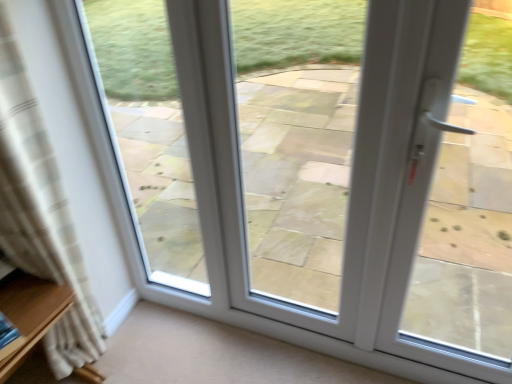
Describe the element at coordinates (31, 313) in the screenshot. I see `wooden shelf at left` at that location.

Find the location of a particular element. wooden shelf at left is located at coordinates (31, 313).

What is the approximate height of white glass door at left?

white glass door at left is 1.23 meters in height.

Identify the location of white glass door at left. Image resolution: width=512 pixels, height=384 pixels. (149, 134).

Describe the element at coordinates (41, 213) in the screenshot. I see `beige plaid curtain at left` at that location.

You are a GUI agent. You are given a task and a screenshot of the screen. Output one action in this format:
    pyautogui.click(x=<x>, y=<y>)
    Task: Click on the beige plaid curtain at left
    The height and width of the screenshot is (384, 512).
    Given the screenshot: What is the action you would take?
    pyautogui.click(x=41, y=213)

Locate an element on the screen. The image size is (512, 384). white glass door at center is located at coordinates (297, 140).

Locate an element on the screen. white plastic door handle at right is located at coordinates (437, 207).

In the scene shown: Looking at their sizes, would you say white plastic door handle at right is wider or thinner than beige plaid curtain at left?

In the image, white plastic door handle at right appears to be more narrow than beige plaid curtain at left.

Is white plastic door handle at right surrounding beige plaid curtain at left?

That's incorrect, beige plaid curtain at left is not inside white plastic door handle at right.

Between white plastic door handle at right and beige plaid curtain at left, which one has smaller size?

white plastic door handle at right is smaller.

Is point (413, 182) behind point (15, 248)?

No, (413, 182) is closer to viewer.

From a real-world perspective, does white glass door at center stand above beige plaid curtain at left?

Indeed, from a real-world perspective, white glass door at center stands above beige plaid curtain at left.

From the image's perspective, between white glass door at center and beige plaid curtain at left, who is located below?

beige plaid curtain at left, from the image's perspective.

Considering the sizes of objects white glass door at center and beige plaid curtain at left in the image provided, who is bigger, white glass door at center or beige plaid curtain at left?

With larger size is beige plaid curtain at left.

Are white glass door at center and white glass door at left far apart?

Actually, white glass door at center and white glass door at left are a little close together.

Could you tell me if white glass door at center is facing white glass door at left?

No, white glass door at center is not aimed at white glass door at left.

Is point (344, 60) behind point (99, 0)?

Yes, point (344, 60) is behind point (99, 0).

From a real-world perspective, is white glass door at center on top of white glass door at left?

Yes, from a real-world perspective, white glass door at center is over white glass door at left

Does wooden shelf at left come behind white glass door at center?

Yes, it is.

Which of these two, wooden shelf at left or white glass door at center, is bigger?

Bigger between the two is wooden shelf at left.

Considering the sizes of wooden shelf at left and white glass door at center in the image, is wooden shelf at left taller or shorter than white glass door at center?

Clearly, wooden shelf at left is shorter compared to white glass door at center.

Relative to wooden shelf at left, is white glass door at center in front or behind?

white glass door at center is in front of wooden shelf at left.

Visually, is white glass door at center positioned to the left or to the right of wooden shelf at left?

Clearly, white glass door at center is on the right of wooden shelf at left in the image.

From a real-world perspective, is white glass door at center positioned above or below wooden shelf at left?

In terms of real-world spatial position, white glass door at center is above wooden shelf at left.

How distant is white glass door at left from white plastic door handle at right?

white glass door at left is 4.76 feet away from white plastic door handle at right.

Between white glass door at left and white plastic door handle at right, which one appears on the right side from the viewer's perspective?

white plastic door handle at right.

Who is taller, white glass door at left or white plastic door handle at right?

Standing taller between the two is white plastic door handle at right.

Is wooden shelf at left spatially inside white glass door at left, or outside of it?

wooden shelf at left is outside white glass door at left.

Which object is positioned more to the left, wooden shelf at left or white glass door at left?

From the viewer's perspective, wooden shelf at left appears more on the left side.

Are wooden shelf at left and white glass door at left far apart?

No, wooden shelf at left is not far away from white glass door at left.

Where is `screen door located below the beige plaid curtain at left (from the image's perspective)`? screen door located below the beige plaid curtain at left (from the image's perspective) is located at coordinates (437, 207).

Locate an element on the screen. This screenshot has height=384, width=512. window on the right of beige plaid curtain at left is located at coordinates 297,140.

Based on their spatial positions, is wooden shelf at left or white plastic door handle at right closer to white glass door at center?

Among the two, white plastic door handle at right is located nearer to white glass door at center.

Considering their positions, is white glass door at center positioned further to wooden shelf at left than white glass door at left?

Based on the image, white glass door at center appears to be further to wooden shelf at left.

Looking at the image, which one is located closer to white glass door at center, white glass door at left or beige plaid curtain at left?

Among the two, white glass door at left is located nearer to white glass door at center.

When comparing their distances from beige plaid curtain at left, does wooden shelf at left or white glass door at center seem further?

Among the two, white glass door at center is located further to beige plaid curtain at left.

When comparing their distances from white plastic door handle at right, does beige plaid curtain at left or white glass door at left seem closer?

white glass door at left.

From the image, which object appears to be nearer to white plastic door handle at right, beige plaid curtain at left or white glass door at center?

Based on the image, white glass door at center appears to be nearer to white plastic door handle at right.

Estimate the real-world distances between objects in this image. Which object is closer to beige plaid curtain at left, white glass door at center or white plastic door handle at right?

Based on the image, white glass door at center appears to be nearer to beige plaid curtain at left.

Estimate the real-world distances between objects in this image. Which object is further from white glass door at center, wooden shelf at left or white glass door at left?

wooden shelf at left lies further to white glass door at center than the other object.

You are a GUI agent. You are given a task and a screenshot of the screen. Output one action in this format:
    pyautogui.click(x=<x>, y=<y>)
    Task: Click on the curtain between white glass door at left and wooden shelf at left in the vertical direction
    
    Given the screenshot: What is the action you would take?
    pyautogui.click(x=41, y=213)

At what (x,y) coordinates should I click in order to perform the action: click on curtain situated between wooden shelf at left and white glass door at center from left to right. Please return your answer as a coordinate pair (x, y). This screenshot has width=512, height=384. Looking at the image, I should click on (41, 213).

At what (x,y) coordinates should I click in order to perform the action: click on window between wooden shelf at left and white plastic door handle at right from left to right. Please return your answer as a coordinate pair (x, y). The width and height of the screenshot is (512, 384). Looking at the image, I should click on (297, 140).

Locate an element on the screen. This screenshot has width=512, height=384. bay window between wooden shelf at left and white glass door at center in the horizontal direction is located at coordinates (149, 134).